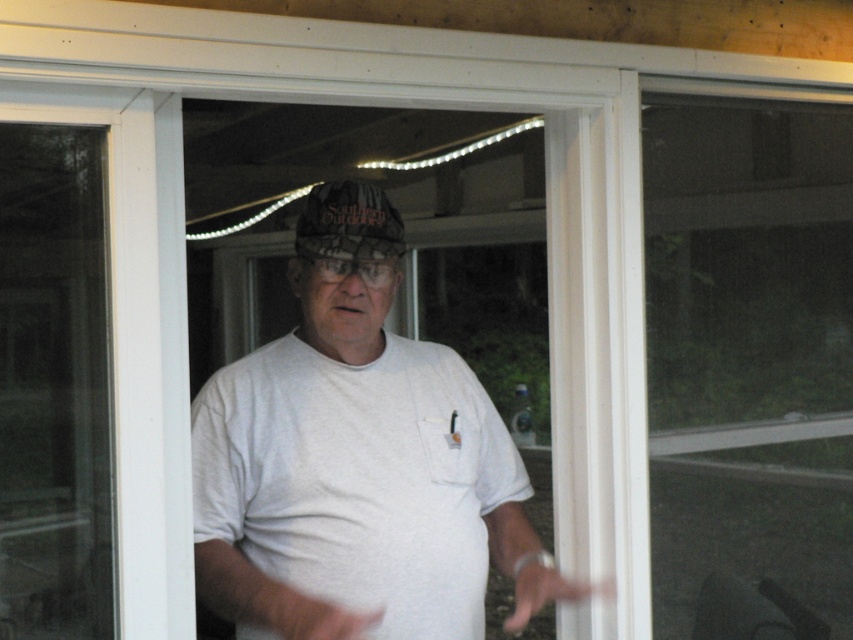
Question: Based on their relative distances, which object is nearer to the camouflage fabric hat at center?

Choices:
 (A) white cotton t-shirt at center
 (B) transparent plastic screen door at right
 (C) transparent plastic screen door at left

Answer: (A)

Question: Where is white cotton t-shirt at center located in relation to transparent plastic screen door at left in the image?

Choices:
 (A) below
 (B) above

Answer: (A)

Question: Is transparent plastic screen door at left to the left of camouflage fabric hat at center from the viewer's perspective?

Choices:
 (A) yes
 (B) no

Answer: (A)

Question: Which point is farther from the camera taking this photo?

Choices:
 (A) (76, 516)
 (B) (265, 484)
 (C) (695, 516)
 (D) (306, 225)

Answer: (C)

Question: Is transparent plastic screen door at right bigger than camouflage fabric hat at center?

Choices:
 (A) yes
 (B) no

Answer: (A)

Question: Which of these objects is positioned closest to the transparent plastic screen door at left?

Choices:
 (A) transparent plastic screen door at right
 (B) camouflage fabric hat at center

Answer: (B)